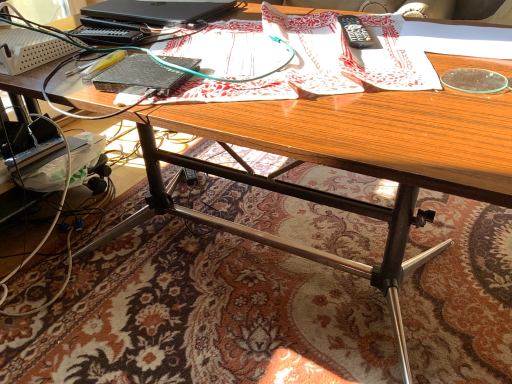
This screenshot has width=512, height=384. I want to click on vacant region in front of black matte laptop at upper left, so click(x=161, y=42).